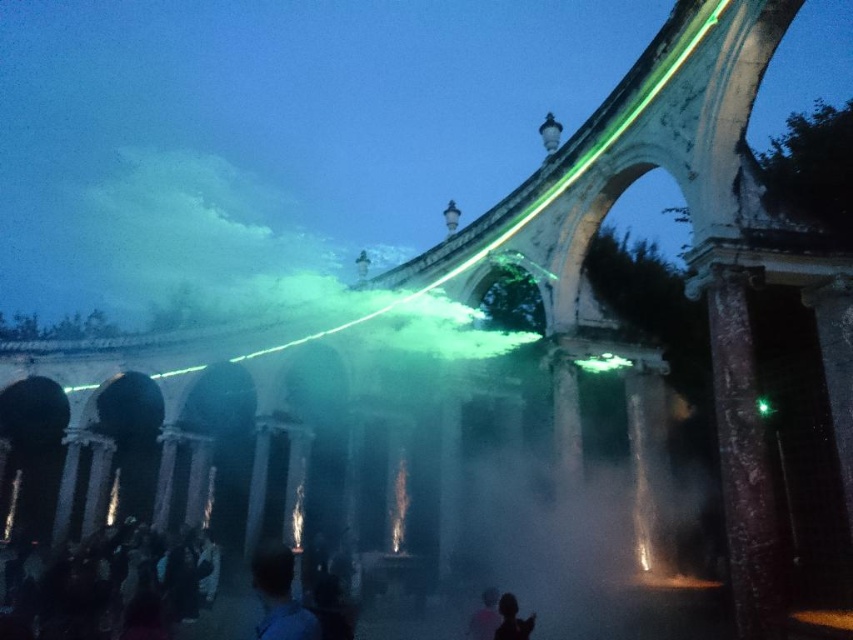
Question: Does silhouette skin at lower center appear on the left side of silvery metallic figure at center?

Choices:
 (A) no
 (B) yes

Answer: (A)

Question: Is brown marble pillar at right in front of silhouette skin at lower center?

Choices:
 (A) no
 (B) yes

Answer: (B)

Question: Which point is closer to the camera taking this photo?

Choices:
 (A) (488, 627)
 (B) (729, 416)

Answer: (B)

Question: Estimate the real-world distances between objects in this image. Which object is farther from the blue fabric at center?

Choices:
 (A) silhouette skin at lower center
 (B) green laser beam at center
 (C) silvery metallic figure at center

Answer: (B)

Question: Based on their relative distances, which object is farther from the green laser beam at center?

Choices:
 (A) brown marble pillar at right
 (B) silvery metallic figure at center

Answer: (B)

Question: Does brown marble pillar at right appear under blue fabric at center?

Choices:
 (A) no
 (B) yes

Answer: (A)